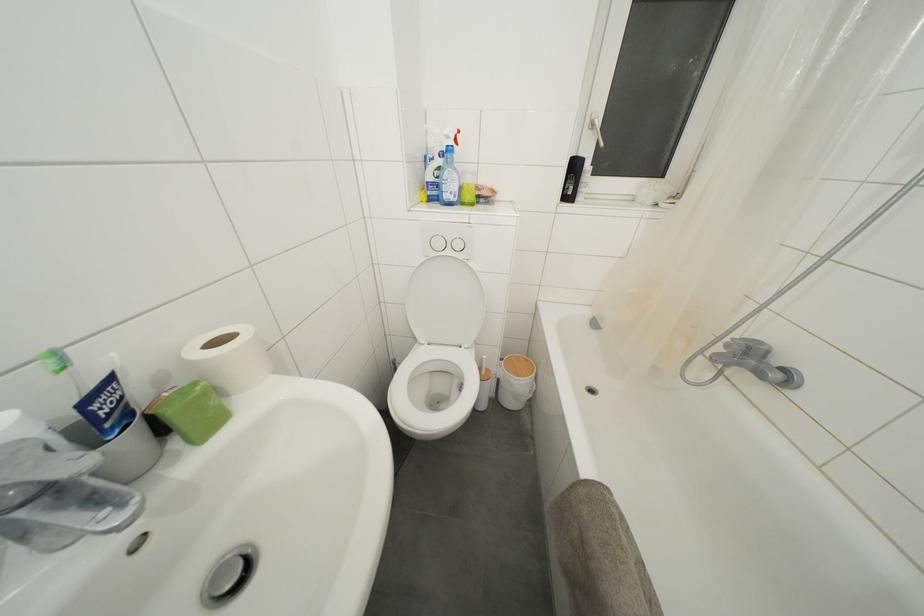
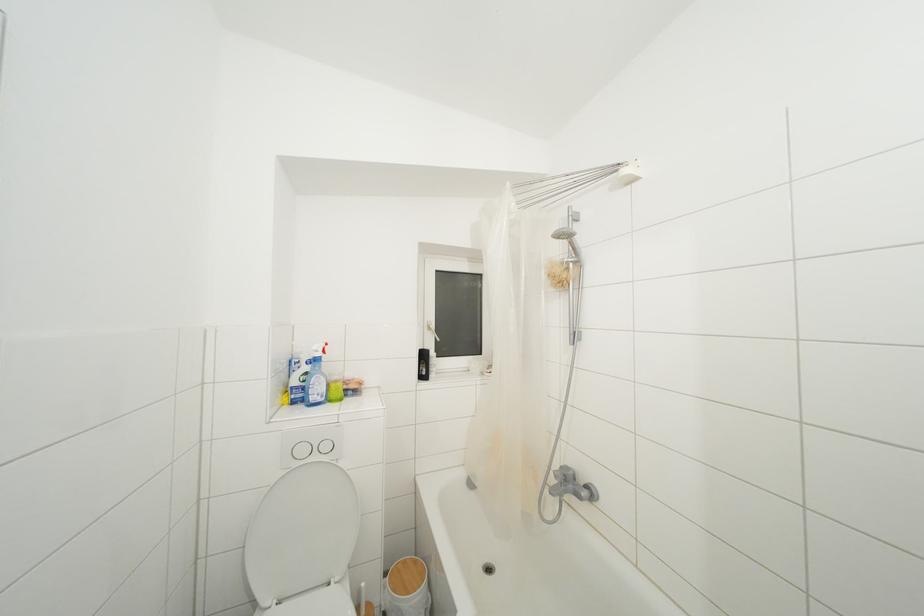
Where in the second image is the point corresponding to the point at 597,131 from the first image?

(433, 333)